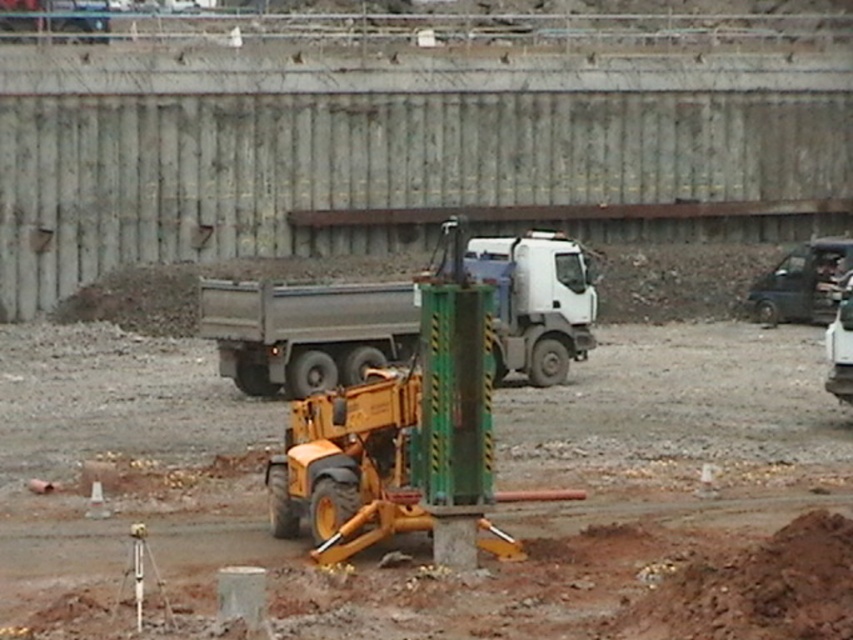
You are a construction worker standing at the origin point of the coordinate system. You need to move to the gray metallic trailer truck at center. What are the coordinates you need to move to?

The coordinates to move to are 0.519 in the x direction and 0.359 in the y direction.

You are a construction worker standing at the camera position. You need to move the gray metallic trailer truck at center to a parking lot 100 feet away. Can you move it directly without moving it further than needed?

The gray metallic trailer truck at center is currently 102.97 feet away from the camera. Since the parking lot is only 100 feet away, moving the truck directly would require it to travel beyond the desired distance, so it cannot be moved directly without exceeding the required distance.

You are a construction supervisor observing the scene. You need to determine the relative sizes of the gray metallic trailer truck at center and the black fabric construction worker at right. Which object is smaller in size?

The gray metallic trailer truck at center is smaller in size compared to the black fabric construction worker at right.